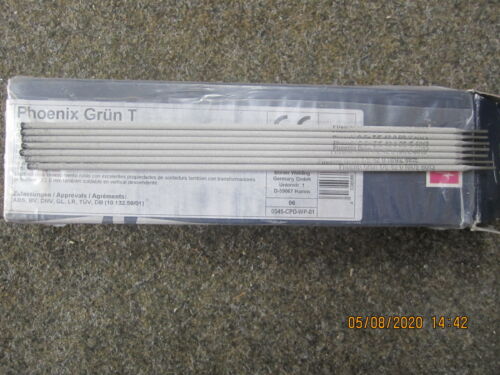
In order to click on white cords in this screenshot , I will do `click(219, 150)`.